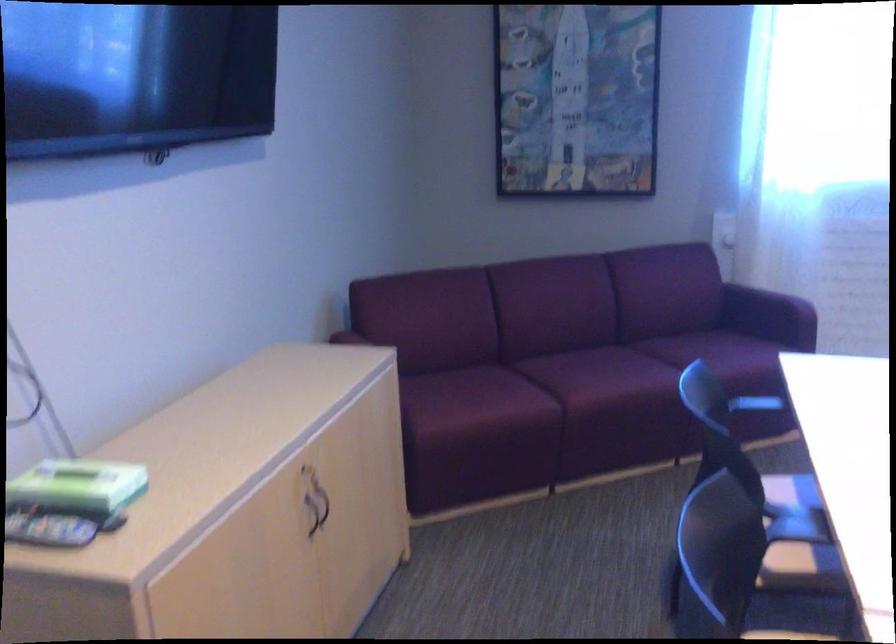
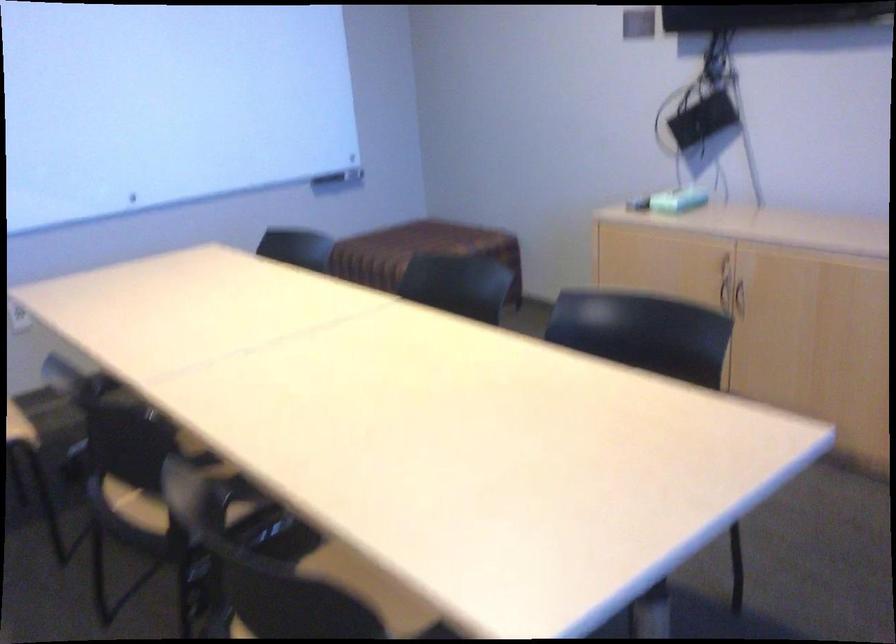
Locate, in the second image, the point that corresponds to point (316, 520) in the first image.

(738, 299)